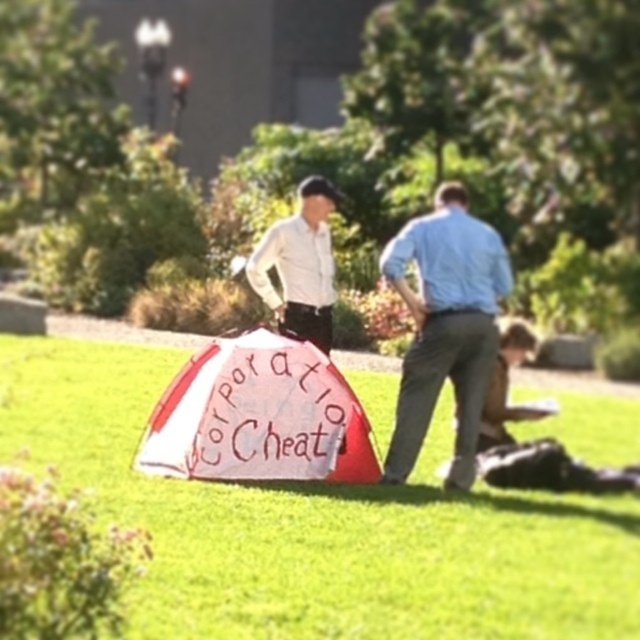
You are planning to place a small picnic basket on the grass. Given the green grass at center and the white glossy shirt at center, which surface is more suitable for placing the basket?

The green grass at center is more suitable for placing the picnic basket since it is wider than the white glossy shirt at center, providing a stable and flat surface.

From the picture: Where is the green grass at center located in the image?

The green grass at center is located at point (316,525).